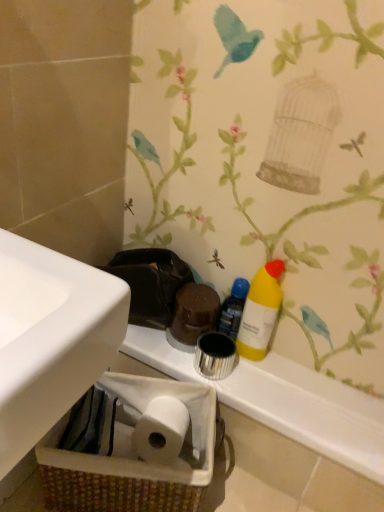
Question: Is yellow matte bottle at center right completely or partially outside of white glossy counter top at center?

Choices:
 (A) yes
 (B) no

Answer: (A)

Question: Is yellow matte bottle at center right not near white glossy counter top at center?

Choices:
 (A) no
 (B) yes

Answer: (A)

Question: Could you tell me if yellow matte bottle at center right is facing white glossy counter top at center?

Choices:
 (A) no
 (B) yes

Answer: (A)

Question: Is white glossy counter top at center at the back of yellow matte bottle at center right?

Choices:
 (A) yes
 (B) no

Answer: (B)

Question: Can you confirm if yellow matte bottle at center right is shorter than white glossy counter top at center?

Choices:
 (A) no
 (B) yes

Answer: (A)

Question: In terms of width, does brown woven basket at lower left look wider or thinner when compared to yellow matte bottle at right?

Choices:
 (A) wide
 (B) thin

Answer: (A)

Question: From a real-world perspective, is brown woven basket at lower left physically located above or below yellow matte bottle at right?

Choices:
 (A) above
 (B) below

Answer: (B)

Question: Looking at the image, does brown woven basket at lower left seem bigger or smaller compared to yellow matte bottle at right?

Choices:
 (A) small
 (B) big

Answer: (B)

Question: From the image's perspective, is brown woven basket at lower left positioned above or below yellow matte bottle at right?

Choices:
 (A) below
 (B) above

Answer: (A)

Question: Considering the positions of point (268, 279) and point (163, 366), is point (268, 279) closer or farther from the camera than point (163, 366)?

Choices:
 (A) closer
 (B) farther

Answer: (A)

Question: In the image, is yellow matte bottle at center right on the left side or the right side of white glossy counter top at center?

Choices:
 (A) right
 (B) left

Answer: (A)

Question: In terms of width, does yellow matte bottle at center right look wider or thinner when compared to white glossy counter top at center?

Choices:
 (A) wide
 (B) thin

Answer: (B)

Question: From the image's perspective, is yellow matte bottle at center right above or below white glossy counter top at center?

Choices:
 (A) below
 (B) above

Answer: (B)

Question: Based on their positions, is white glossy counter top at center located to the left or right of yellow matte bottle at right?

Choices:
 (A) left
 (B) right

Answer: (B)

Question: Considering the positions of white glossy counter top at center and yellow matte bottle at right in the image, is white glossy counter top at center taller or shorter than yellow matte bottle at right?

Choices:
 (A) short
 (B) tall

Answer: (A)